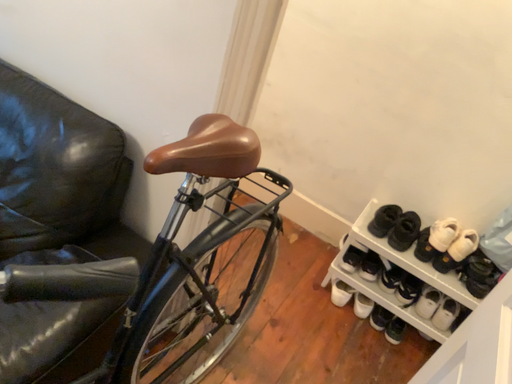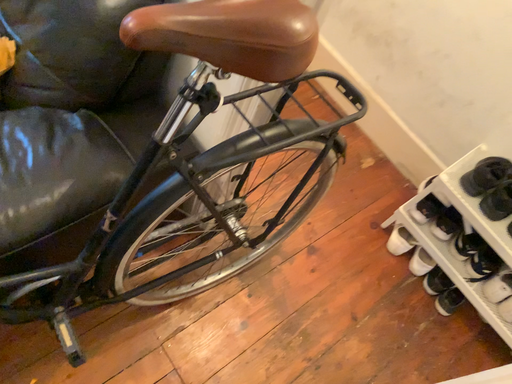
Question: How did the camera likely rotate when shooting the video?

Choices:
 (A) rotated left
 (B) rotated right

Answer: (A)